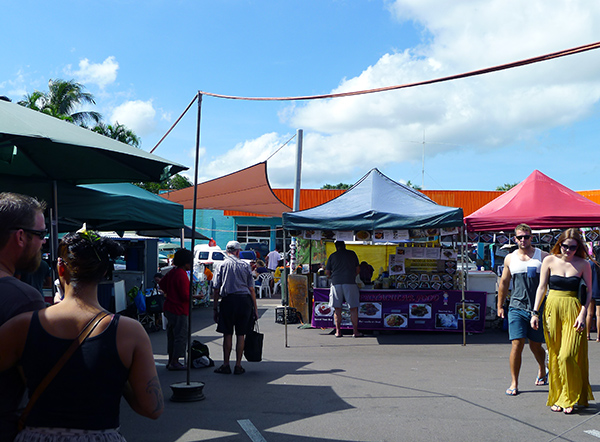
Where is `booth`? booth is located at coordinates (391, 311).